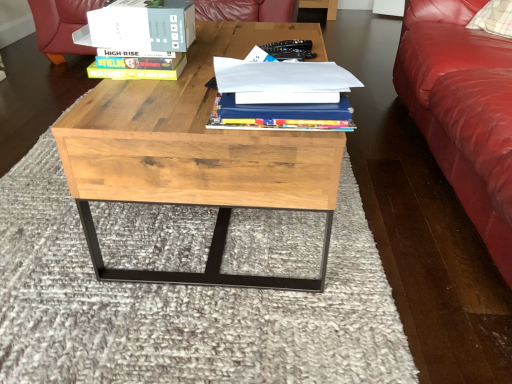
What are the coordinates of `free location in front of natural wood coffee table at center` in the screenshot? It's located at (209, 323).